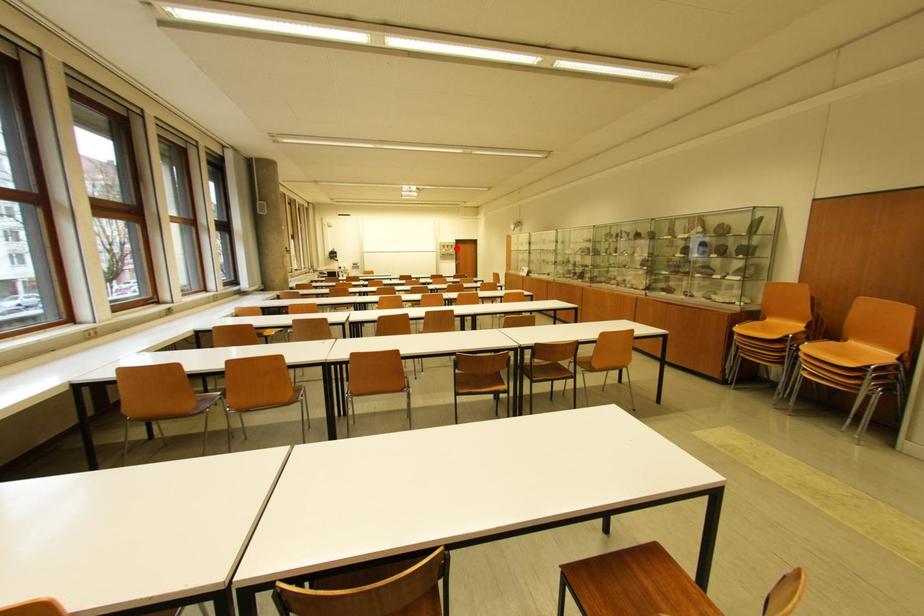
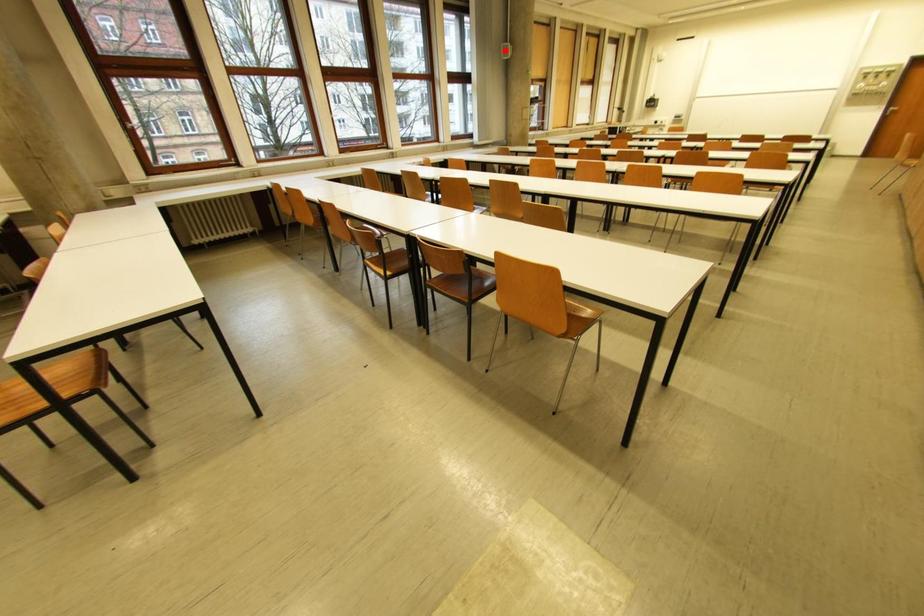
I am providing you with two images of the same scene from different viewpoints. A red point is marked on the first image and another point is marked on the second image. Do the highlighted points in image1 and image2 indicate the same real-world spot?

No